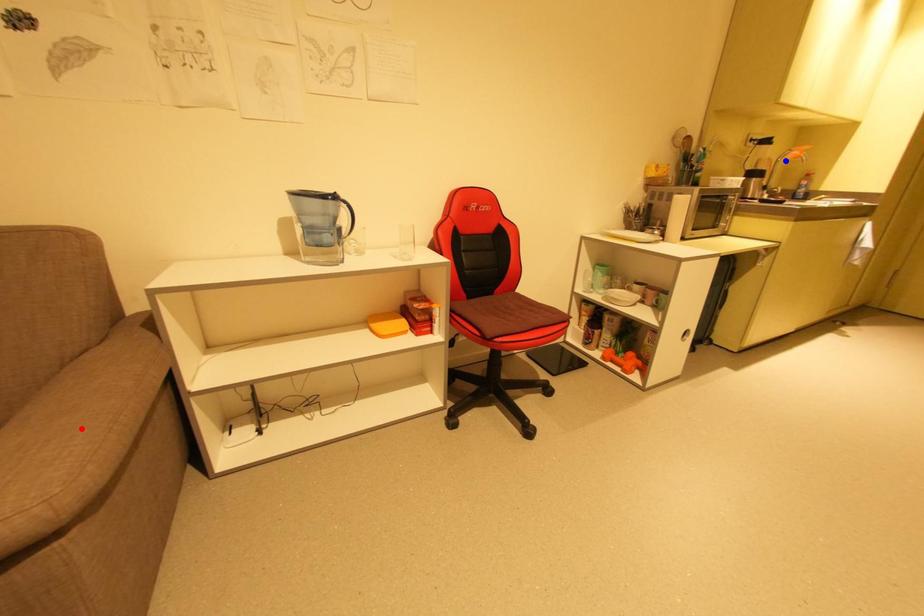
Question: Two points are marked on the image. Which point is closer to the camera?

Choices:
 (A) Blue point is closer.
 (B) Red point is closer.

Answer: (B)